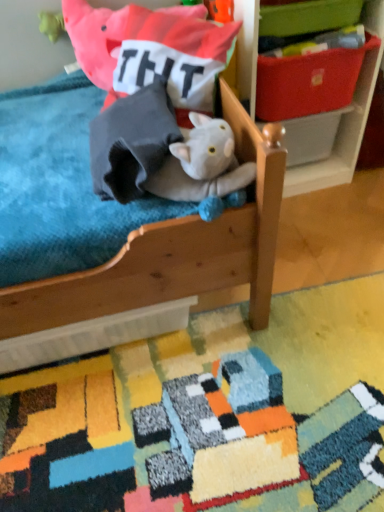
Question: Considering the relative positions of wooden shelf at upper right and soft cotton pillow at upper center in the image provided, is wooden shelf at upper right to the left of soft cotton pillow at upper center from the viewer's perspective?

Choices:
 (A) no
 (B) yes

Answer: (A)

Question: Can you confirm if wooden shelf at upper right is positioned to the right of soft cotton pillow at upper center?

Choices:
 (A) no
 (B) yes

Answer: (B)

Question: From the image's perspective, is wooden shelf at upper right under soft cotton pillow at upper center?

Choices:
 (A) no
 (B) yes

Answer: (A)

Question: Is wooden shelf at upper right positioned far away from soft cotton pillow at upper center?

Choices:
 (A) yes
 (B) no

Answer: (B)

Question: Is soft cotton pillow at upper center surrounded by wooden shelf at upper right?

Choices:
 (A) no
 (B) yes

Answer: (A)

Question: Considering the relative sizes of wooden shelf at upper right and soft cotton pillow at upper center in the image provided, is wooden shelf at upper right bigger than soft cotton pillow at upper center?

Choices:
 (A) yes
 (B) no

Answer: (A)

Question: Does fluffy gray cat at center have a lesser width compared to wooden bed at center?

Choices:
 (A) no
 (B) yes

Answer: (B)

Question: Is wooden bed at center completely or partially inside fluffy gray cat at center?

Choices:
 (A) yes
 (B) no

Answer: (B)

Question: From a real-world perspective, is fluffy gray cat at center physically below wooden bed at center?

Choices:
 (A) no
 (B) yes

Answer: (A)

Question: Is fluffy gray cat at center wider than wooden bed at center?

Choices:
 (A) yes
 (B) no

Answer: (B)

Question: Does fluffy gray cat at center come in front of wooden bed at center?

Choices:
 (A) yes
 (B) no

Answer: (B)

Question: Considering the relative sizes of fluffy gray cat at center and wooden bed at center in the image provided, is fluffy gray cat at center smaller than wooden bed at center?

Choices:
 (A) yes
 (B) no

Answer: (A)

Question: Is white plastic storage box at center, the first storage box from the bottom, positioned with its back to multicolored textured rug at lower center?

Choices:
 (A) yes
 (B) no

Answer: (B)